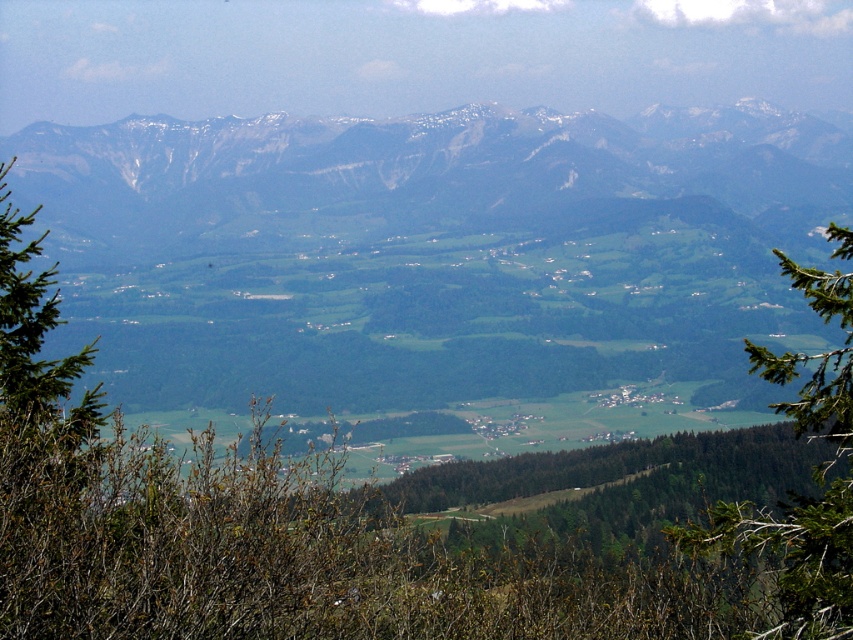
Question: Can you confirm if snowy rocky mountain range at upper center is thinner than green leafy tree at center-right?

Choices:
 (A) no
 (B) yes

Answer: (A)

Question: Which point is closer to the camera?

Choices:
 (A) green leafy tree at center-right
 (B) snowy rocky mountain range at upper center

Answer: (A)

Question: Where is snowy rocky mountain range at upper center located in relation to green leafy tree at center-right in the image?

Choices:
 (A) below
 (B) above

Answer: (B)

Question: Does snowy rocky mountain range at upper center have a greater width compared to green leafy tree at center-right?

Choices:
 (A) yes
 (B) no

Answer: (A)

Question: Which point is closer to the camera?

Choices:
 (A) green leafy tree at center-right
 (B) snowy rocky mountain range at upper center

Answer: (A)